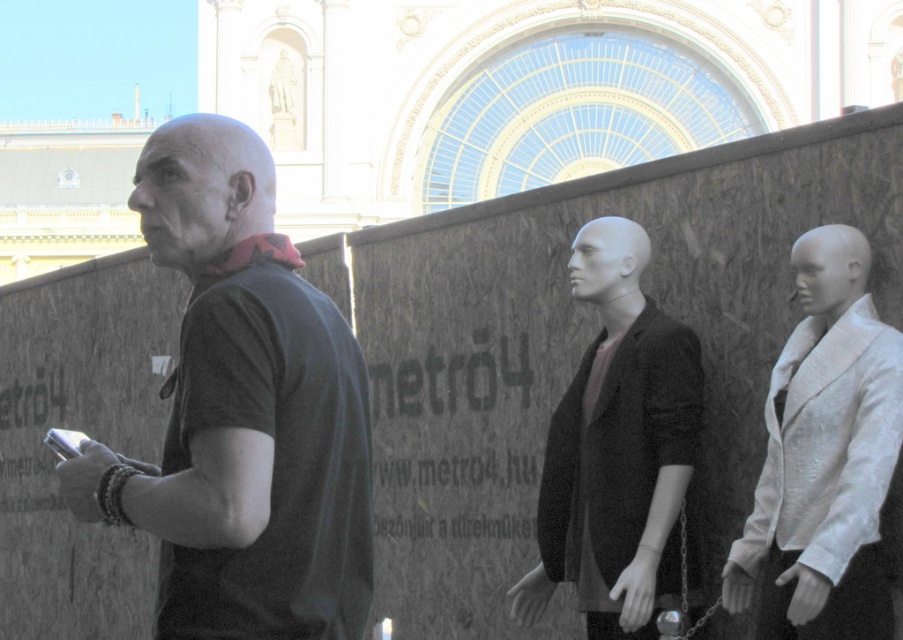
Question: Is dark gray t-shirt at left bigger than smooth matte mannequin at center?

Choices:
 (A) no
 (B) yes

Answer: (B)

Question: Does dark gray t-shirt at left appear on the right side of white silk jacket at right?

Choices:
 (A) no
 (B) yes

Answer: (A)

Question: Observing the image, what is the correct spatial positioning of white silk jacket at right in reference to smooth matte mannequin at center?

Choices:
 (A) right
 (B) left

Answer: (A)

Question: Among these objects, which one is nearest to the camera?

Choices:
 (A) white silk jacket at right
 (B) dark gray t-shirt at left

Answer: (B)

Question: Which of the following is the farthest from the observer?

Choices:
 (A) white silk jacket at right
 (B) smooth matte mannequin at center
 (C) dark gray t-shirt at left

Answer: (B)

Question: Which object is positioned closest to the white silk jacket at right?

Choices:
 (A) dark gray t-shirt at left
 (B) smooth matte mannequin at center

Answer: (B)